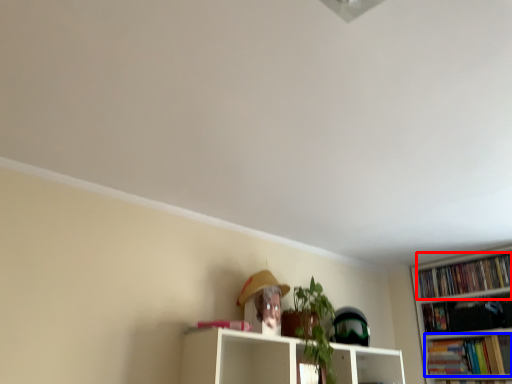
Question: Which of the following is the farthest to the observer, book (highlighted by a red box) or book (highlighted by a blue box)?

Choices:
 (A) book
 (B) book

Answer: (A)